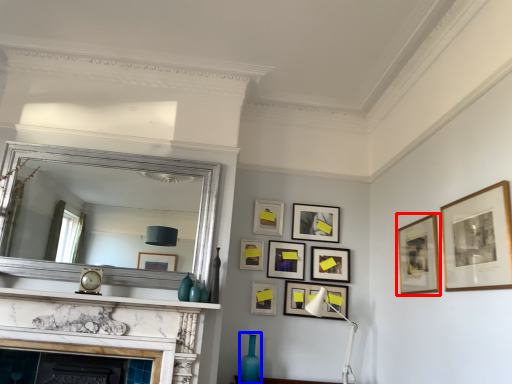
Question: Which object appears closest to the camera in this image, picture frame (highlighted by a red box) or vase (highlighted by a blue box)?

Choices:
 (A) picture frame
 (B) vase

Answer: (A)